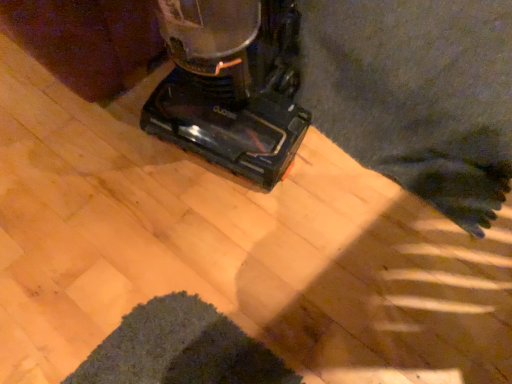
Find the location of a particular element. spots to the right of black plastic vacuum cleaner at center is located at coordinates (379, 175).